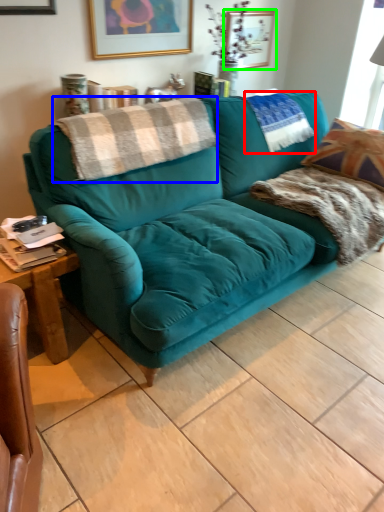
Question: Considering the real-world distances, which object is farthest from pillow (highlighted by a red box)? blanket (highlighted by a blue box) or picture frame (highlighted by a green box)?

Choices:
 (A) blanket
 (B) picture frame

Answer: (A)